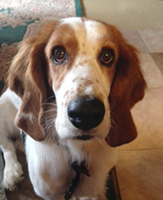
You are a GUI agent. You are given a task and a screenshot of the screen. Output one action in this format:
    pyautogui.click(x=<x>, y=<y>)
    Task: Click on the stone tile
    
    Given the screenshot: What is the action you would take?
    pyautogui.click(x=150, y=42), pyautogui.click(x=132, y=42), pyautogui.click(x=149, y=74), pyautogui.click(x=153, y=117), pyautogui.click(x=151, y=179), pyautogui.click(x=160, y=60)